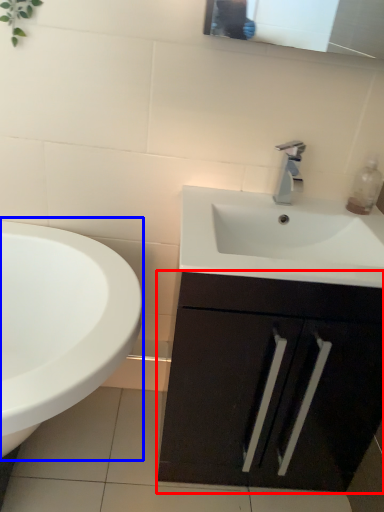
Question: Which of the following is the farthest to the observer, bathroom cabinet (highlighted by a red box) or sink (highlighted by a blue box)?

Choices:
 (A) bathroom cabinet
 (B) sink

Answer: (A)